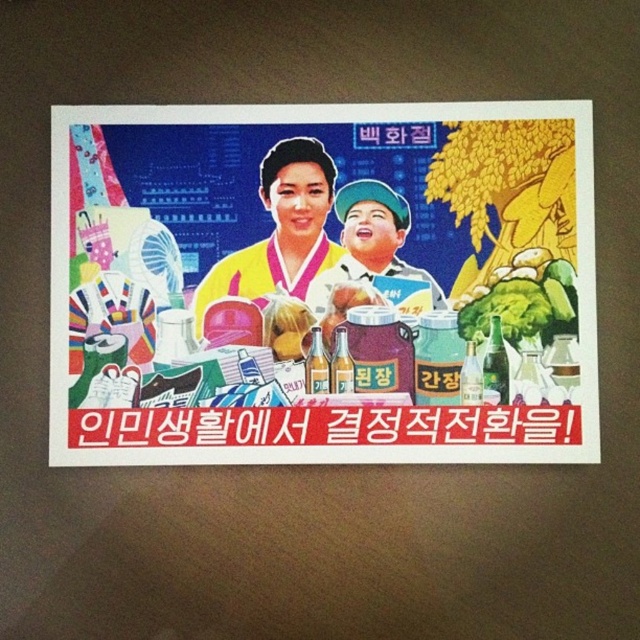
Question: Can you confirm if yellow silk kimono at center is positioned to the right of matte plastic cup at center?

Choices:
 (A) yes
 (B) no

Answer: (B)

Question: Which point is closer to the camera taking this photo?

Choices:
 (A) (364, 269)
 (B) (305, 188)
 (C) (456, 364)

Answer: (C)

Question: Estimate the real-world distances between objects in this image. Which object is closer to the matte plastic cup at center?

Choices:
 (A) yellow silk kimono at center
 (B) matte plastic bottle at center

Answer: (A)

Question: Is matte plastic bottle at center positioned in front of yellow silk kimono at center?

Choices:
 (A) yes
 (B) no

Answer: (A)

Question: Based on their relative distances, which object is farther from the matte plastic bottle at center?

Choices:
 (A) yellow silk kimono at center
 (B) matte plastic cup at center

Answer: (B)

Question: Is matte plastic bottle at center bigger than matte plastic cup at center?

Choices:
 (A) yes
 (B) no

Answer: (A)